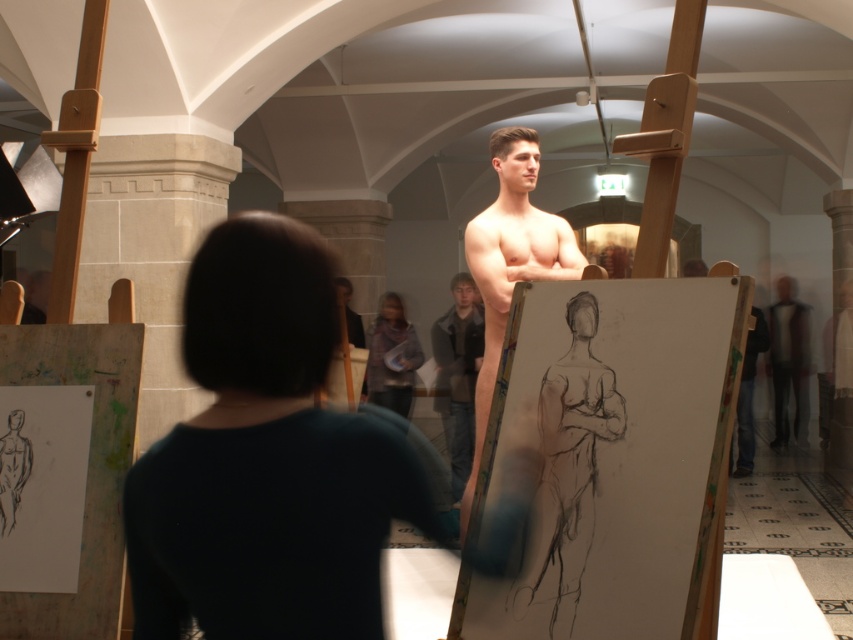
Question: Which of the following is the farthest from the observer?

Choices:
 (A) smooth skin man at center
 (B) dark brown leather jacket at center
 (C) smooth skin mannequin at center
 (D) smooth black mannequin at center

Answer: (D)

Question: Which point is closer to the camera taking this photo?

Choices:
 (A) (469, 349)
 (B) (154, 582)

Answer: (B)

Question: Is smooth skin man at center closer to camera compared to dark brown leather jacket at center?

Choices:
 (A) yes
 (B) no

Answer: (A)

Question: Is smooth skin mannequin at center to the left of dark brown leather jacket at center from the viewer's perspective?

Choices:
 (A) yes
 (B) no

Answer: (B)

Question: Does dark brown leather jacket at center appear over smooth black mannequin at center?

Choices:
 (A) no
 (B) yes

Answer: (A)

Question: Which of the following is the farthest from the observer?

Choices:
 (A) (508, 145)
 (B) (248, 408)
 (C) (474, 296)

Answer: (C)